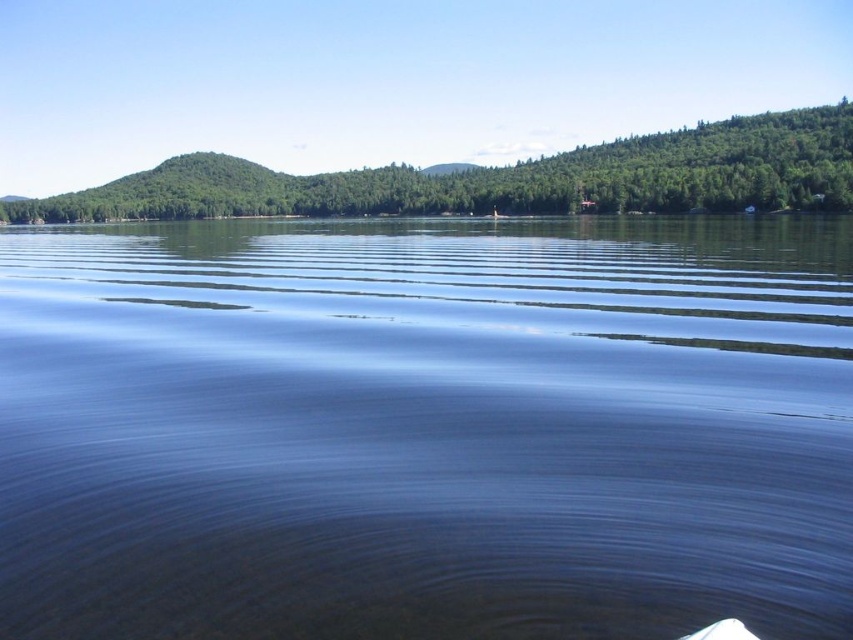
You are standing at the lakeside and see the transparent water at center and the green matte tree at upper center. Which object is located to the right of the other?

The transparent water at center is positioned on the right side of green matte tree at upper center.

You are standing on the lakeside and notice the transparent water at center and the green matte tree at upper center. Which object is closer to you?

The transparent water at center is closer to you because it is in front of the green matte tree at upper center.